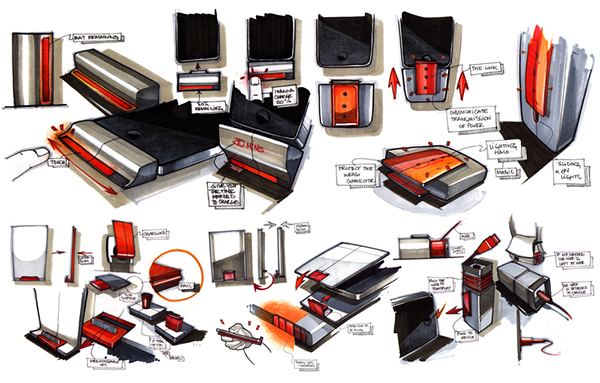
At what (x,y) coordinates should I click in order to perform the action: click on orange light\. Please return your answer as a coordinate pair (x, y). The width and height of the screenshot is (600, 383). Looking at the image, I should click on (288, 310).